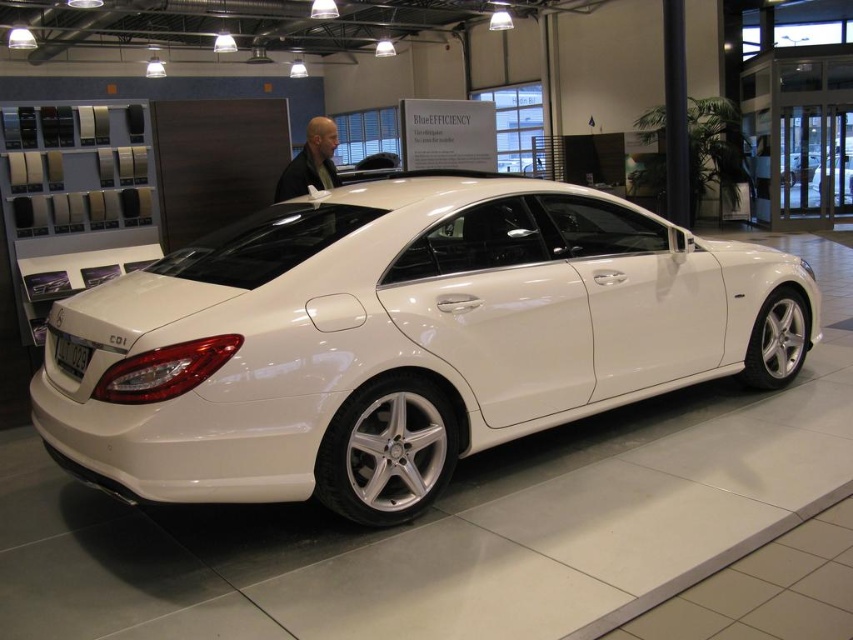
You are a customer looking at the white metallic car at center in the showroom. There is also a person with light brown hair at center nearby. From your perspective, which object is taller?

The light brown hair at center is taller than the white metallic car at center.

You are a delivery person carrying a box that is 3 meters long. You need to move it through the space between the white metallic car at center and the light brown hair at center. Is the space between them wide enough for the box?

The distance between the white metallic car at center and the light brown hair at center is 2.52 meters, which is shorter than the 3 meters length of the box. Therefore, the space is not wide enough to move the box through.

You are a customer in a car dealership and see the white metallic car at center and the light brown hair at center. Which object takes up more space in the scene?

The light brown hair at center takes up more space in the scene than the white metallic car at center.